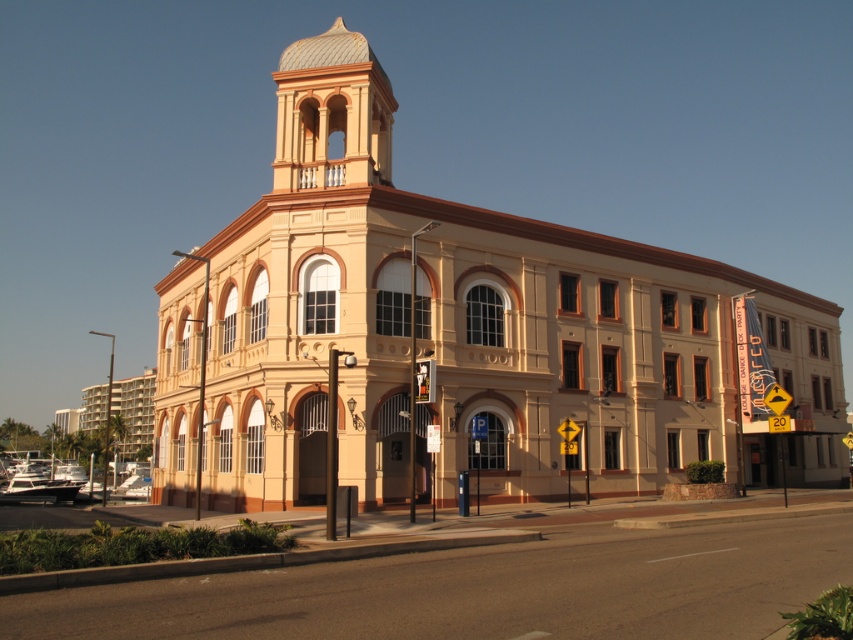
Who is more distant from viewer, (556, 458) or (334, 168)?

The point (556, 458) is more distant.

Can you confirm if beige stone church at center is thinner than smooth cream stucco bell tower at upper center?

No.

The image size is (853, 640). Identify the location of beige stone church at center. (460, 333).

The image size is (853, 640). What are the coordinates of `beige stone church at center` in the screenshot? It's located at (460, 333).